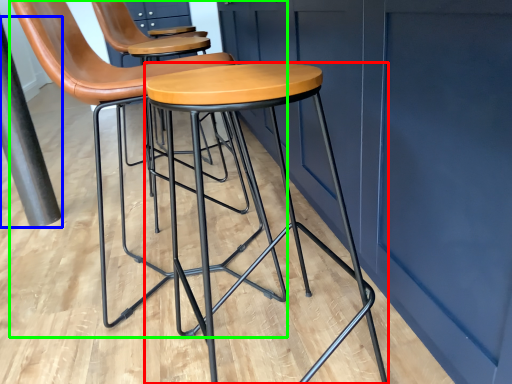
Question: Which object is positioned closest to stool (highlighted by a red box)? Select from pole (highlighted by a blue box) and chair (highlighted by a green box).

Choices:
 (A) pole
 (B) chair

Answer: (B)